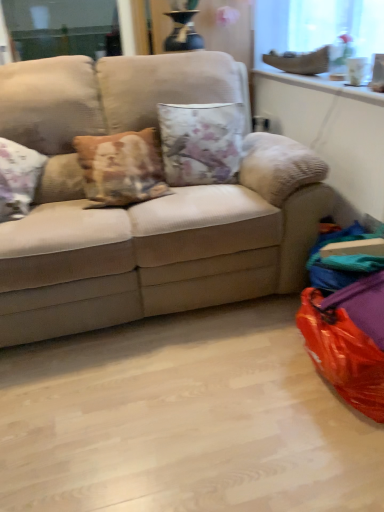
Question: From the image's perspective, does floral fabric cushion at center appear lower than beige fabric couch at center?

Choices:
 (A) no
 (B) yes

Answer: (A)

Question: Does floral fabric cushion at center have a lesser height compared to beige fabric couch at center?

Choices:
 (A) no
 (B) yes

Answer: (B)

Question: Is floral fabric cushion at center at the right side of beige fabric couch at center?

Choices:
 (A) no
 (B) yes

Answer: (B)

Question: Would you say floral fabric cushion at center is outside beige fabric couch at center?

Choices:
 (A) yes
 (B) no

Answer: (B)

Question: Does floral fabric cushion at center have a greater height compared to beige fabric couch at center?

Choices:
 (A) yes
 (B) no

Answer: (B)

Question: In terms of width, does orange plastic bean bag chair at lower right look wider or thinner when compared to beige fabric couch at center?

Choices:
 (A) thin
 (B) wide

Answer: (A)

Question: From the image's perspective, relative to beige fabric couch at center, is orange plastic bean bag chair at lower right above or below?

Choices:
 (A) below
 (B) above

Answer: (A)

Question: Is point (347, 339) closer or farther from the camera than point (261, 189)?

Choices:
 (A) farther
 (B) closer

Answer: (B)

Question: Visually, is orange plastic bean bag chair at lower right positioned to the left or to the right of beige fabric couch at center?

Choices:
 (A) right
 (B) left

Answer: (A)

Question: Considering the positions of point (x=370, y=49) and point (x=177, y=193), is point (x=370, y=49) closer or farther from the camera than point (x=177, y=193)?

Choices:
 (A) closer
 (B) farther

Answer: (A)

Question: Choose the correct answer: Is translucent glass window screen at upper right inside beige fabric couch at center or outside it?

Choices:
 (A) outside
 (B) inside

Answer: (A)

Question: In terms of size, does translucent glass window screen at upper right appear bigger or smaller than beige fabric couch at center?

Choices:
 (A) big
 (B) small

Answer: (B)

Question: From their relative heights in the image, would you say translucent glass window screen at upper right is taller or shorter than beige fabric couch at center?

Choices:
 (A) short
 (B) tall

Answer: (A)

Question: Which is correct: floral fabric cushion at center is inside beige fabric couch at center, or outside of it?

Choices:
 (A) outside
 (B) inside

Answer: (B)

Question: From the image's perspective, relative to beige fabric couch at center, is floral fabric cushion at center above or below?

Choices:
 (A) below
 (B) above

Answer: (B)